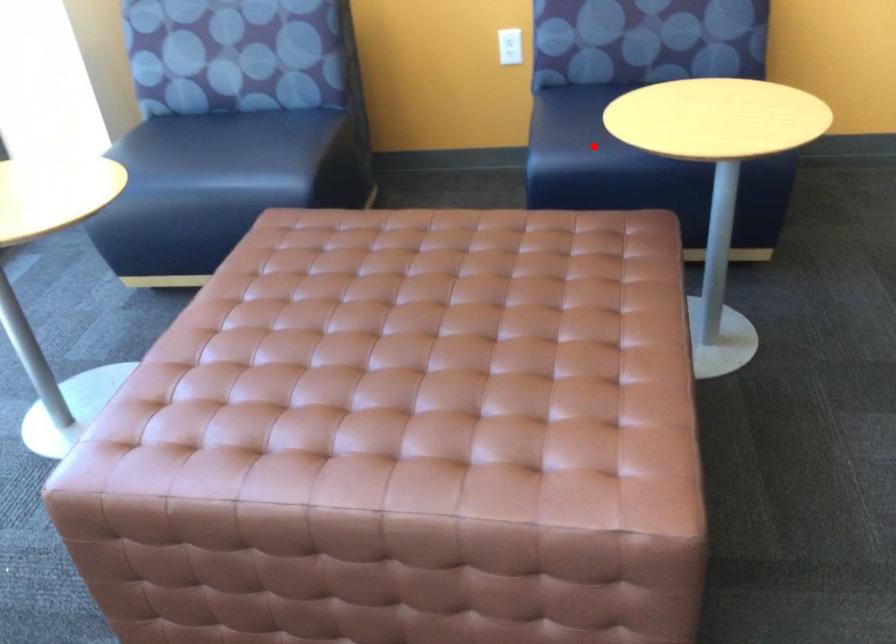
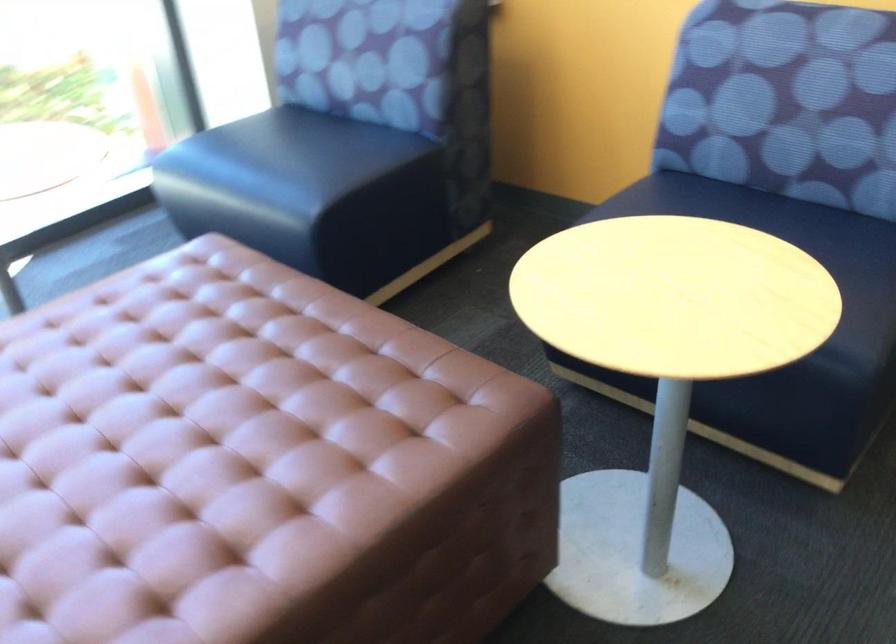
Question: I am providing you with two images of the same scene from different viewpoints. A red point is marked on the first image. Is the red point's position out of view in image 2?

Choices:
 (A) Yes
 (B) No

Answer: (A)